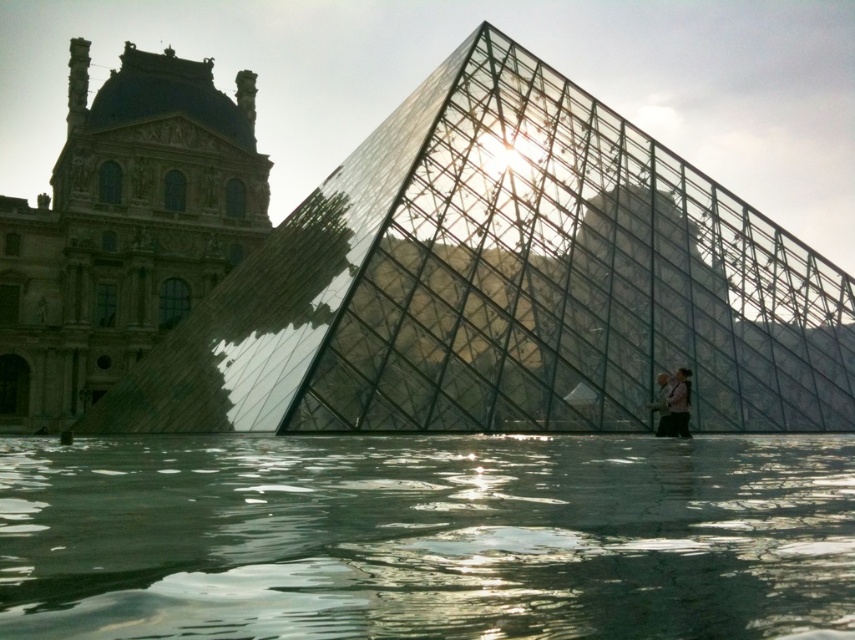
Does transparent glass water at center lie in front of light brown leather jacket at lower right?

Yes, it is.

Looking at this image, can you confirm if transparent glass water at center is positioned below light brown leather jacket at lower right?

Correct, transparent glass water at center is located below light brown leather jacket at lower right.

The height and width of the screenshot is (640, 855). Describe the element at coordinates (428, 536) in the screenshot. I see `transparent glass water at center` at that location.

At what (x,y) coordinates should I click in order to perform the action: click on transparent glass water at center. Please return your answer as a coordinate pair (x, y). This screenshot has width=855, height=640. Looking at the image, I should click on (428, 536).

Does transparent glass pyramid at center come behind pink fabric person at lower right?

That is False.

Does point (768, 394) come closer to viewer compared to point (664, 378)?

No.

I want to click on transparent glass pyramid at center, so click(505, 285).

Is transparent glass water at center closer to camera compared to pink fabric person at lower right?

That is True.

Locate an element on the screen. transparent glass water at center is located at coordinates (428, 536).